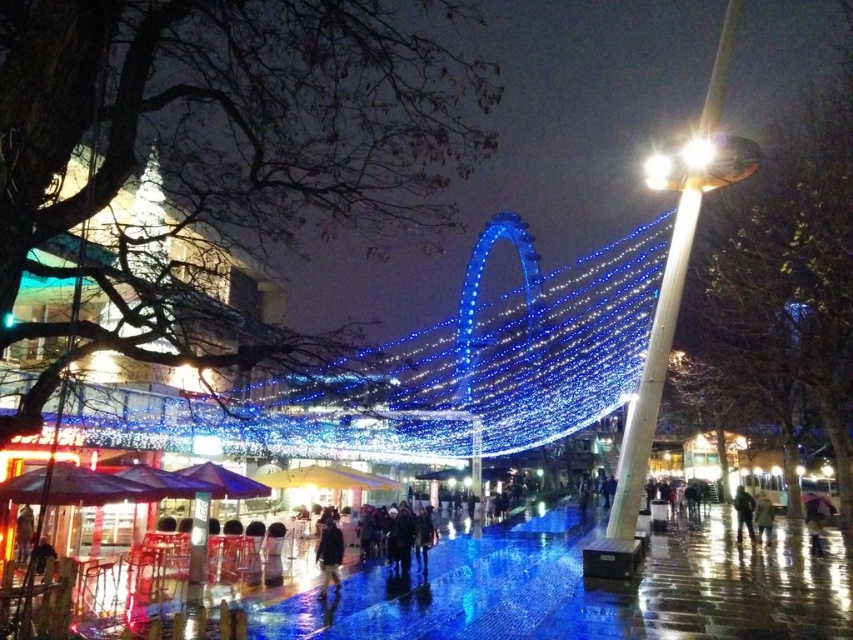
Can you confirm if dark blue fabric jacket at center is taller than dark blue jacket at center?

In fact, dark blue fabric jacket at center may be shorter than dark blue jacket at center.

Does dark blue fabric jacket at center have a lesser width compared to dark blue jacket at center?

Yes, dark blue fabric jacket at center is thinner than dark blue jacket at center.

What are the coordinates of `dark blue fabric jacket at center` in the screenshot? It's located at (329, 554).

Is the position of matte plastic chairs at lower left more distant than that of dark blue jacket at center?

No, matte plastic chairs at lower left is in front of dark blue jacket at center.

This screenshot has height=640, width=853. Find the location of `matte plastic chairs at lower left`. matte plastic chairs at lower left is located at coordinates (589, 589).

Measure the distance between point [830,632] and camera.

Point [830,632] is 78.30 meters from camera.

The width and height of the screenshot is (853, 640). In order to click on matte plastic chairs at lower left in this screenshot , I will do `click(589, 589)`.

Between matte plastic chairs at lower left and dark blue fabric jacket at center, which one is positioned lower?

matte plastic chairs at lower left

Is matte plastic chairs at lower left to the right of dark blue fabric jacket at center from the viewer's perspective?

Correct, you'll find matte plastic chairs at lower left to the right of dark blue fabric jacket at center.

Which is behind, point (556, 554) or point (329, 538)?

The point (556, 554) is more distant.

What are the coordinates of `matte plastic chairs at lower left` in the screenshot? It's located at (x=589, y=589).